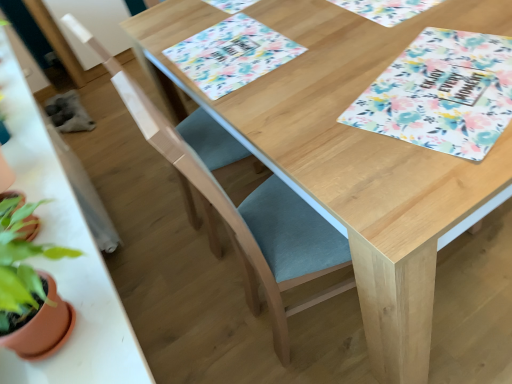
Locate an element on the screen. This screenshot has height=384, width=512. vacant space that is to the left of floral fabric placemat at upper right is located at coordinates (318, 127).